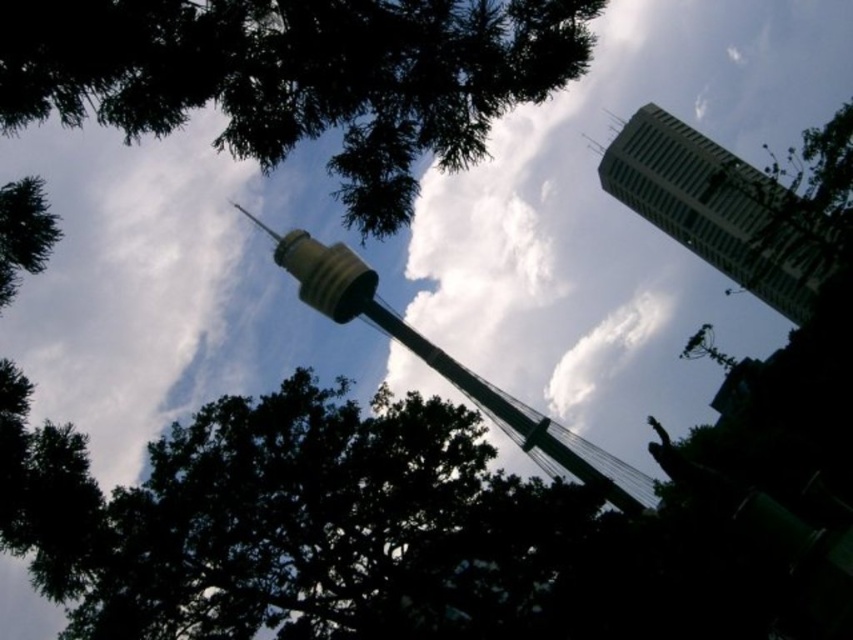
Is dark green leafy tree at lower center taller than green metallic tower at center?

Incorrect, dark green leafy tree at lower center's height is not larger of green metallic tower at center's.

Which of these two, dark green leafy tree at lower center or green metallic tower at center, stands taller?

Standing taller between the two is green metallic tower at center.

The width and height of the screenshot is (853, 640). Identify the location of dark green leafy tree at lower center. (332, 525).

In order to click on dark green leafy tree at lower center in this screenshot , I will do `click(332, 525)`.

Is point (276, 588) more distant than point (286, 36)?

Yes, point (276, 588) is farther from viewer.

Between point (236, 605) and point (152, 51), which one is positioned behind?

Positioned behind is point (236, 605).

I want to click on dark green leafy tree at lower center, so click(332, 525).

Who is shorter, green leafy tree at upper left or green metallic tower at center?

green leafy tree at upper left is shorter.

Identify the location of green leafy tree at upper left. (299, 76).